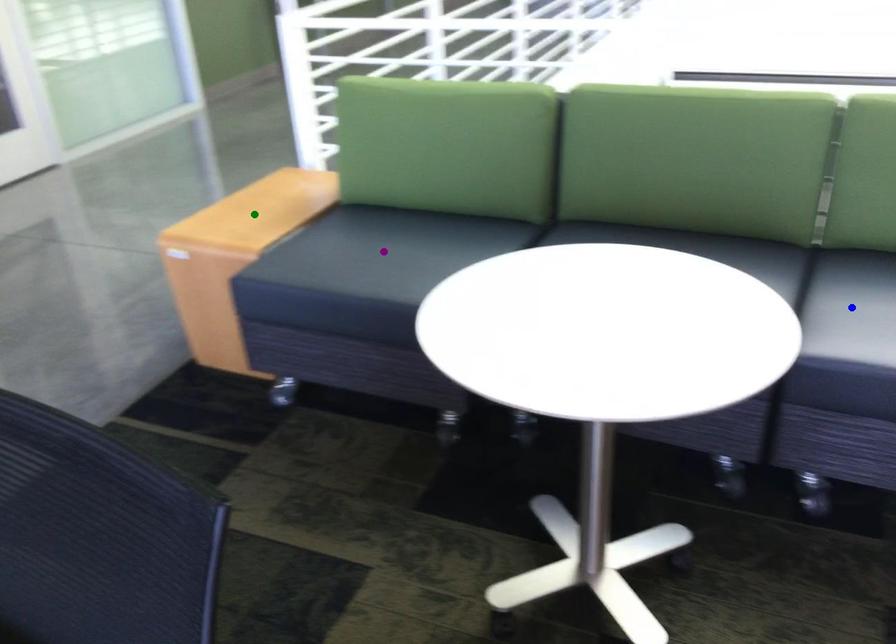
In the scene shown: Order these from farthest to nearest:
1. blue point
2. green point
3. purple point

green point
purple point
blue point